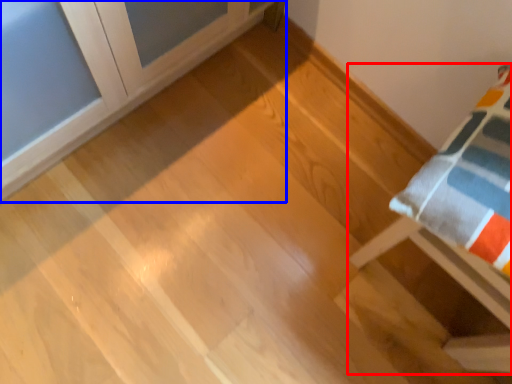
Question: Which point is further to the camera, furniture (highlighted by a red box) or furniture (highlighted by a blue box)?

Choices:
 (A) furniture
 (B) furniture

Answer: (A)